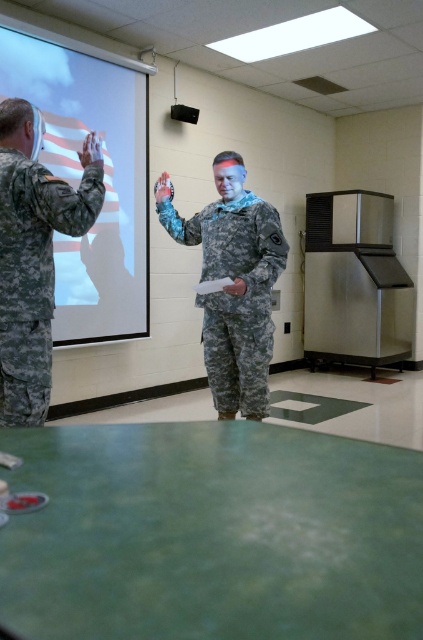
Question: Can you confirm if white matte projection screen at upper left is positioned above camouflage fabric uniform at center?

Choices:
 (A) yes
 (B) no

Answer: (A)

Question: In this image, where is white matte projection screen at upper left located relative to camouflage fabric uniform at center?

Choices:
 (A) left
 (B) right

Answer: (A)

Question: Is camouflage fabric uniform at left to the left of camouflage fabric uniform at center from the viewer's perspective?

Choices:
 (A) yes
 (B) no

Answer: (A)

Question: Considering the real-world distances, which object is farthest from the camouflage fabric uniform at center?

Choices:
 (A) camouflage fabric uniform at left
 (B) white matte projection screen at upper left

Answer: (B)

Question: Which of the following is the closest to the observer?

Choices:
 (A) camouflage fabric uniform at left
 (B) white matte projection screen at upper left
 (C) camouflage fabric uniform at center

Answer: (A)

Question: Which object appears closest to the camera in this image?

Choices:
 (A) camouflage fabric uniform at left
 (B) white matte projection screen at upper left
 (C) camouflage fabric uniform at center

Answer: (A)